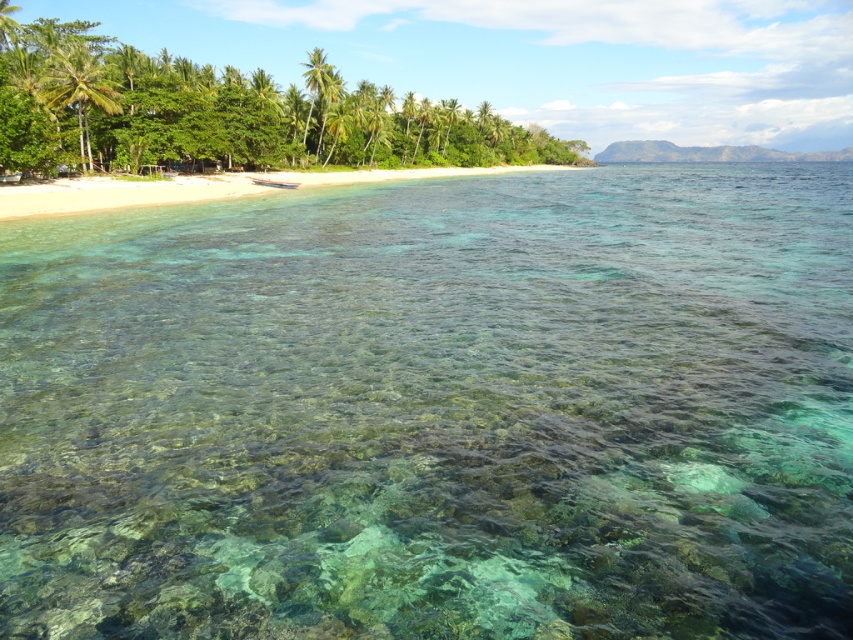
Is the position of clear water at center less distant than that of green leafy palm tree at upper left?

Yes, it is in front of green leafy palm tree at upper left.

Does point (407, 520) come in front of point (53, 68)?

Yes.

Identify the location of clear water at center. The width and height of the screenshot is (853, 640). (434, 410).

Is green leafy palm tree at upper left shorter than green leafy palm tree at center?

Indeed, green leafy palm tree at upper left has a lesser height compared to green leafy palm tree at center.

Does green leafy palm tree at upper left have a greater width compared to green leafy palm tree at center?

Incorrect, green leafy palm tree at upper left's width does not surpass green leafy palm tree at center's.

Where is `green leafy palm tree at upper left`? This screenshot has width=853, height=640. green leafy palm tree at upper left is located at coordinates (78, 88).

Can you confirm if clear water at center is taller than green leafy palm tree at center?

No, clear water at center is not taller than green leafy palm tree at center.

Locate an element on the screen. Image resolution: width=853 pixels, height=640 pixels. clear water at center is located at coordinates (434, 410).